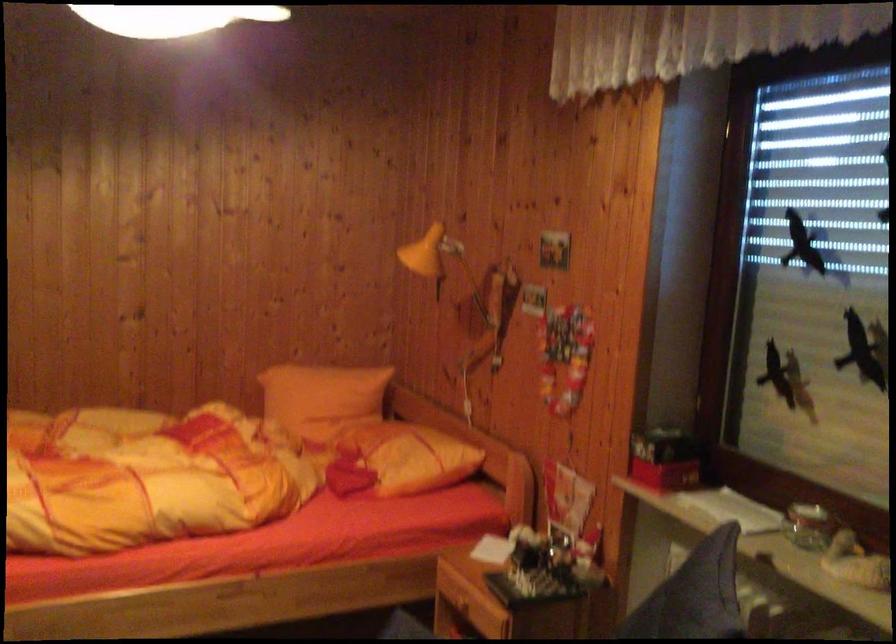
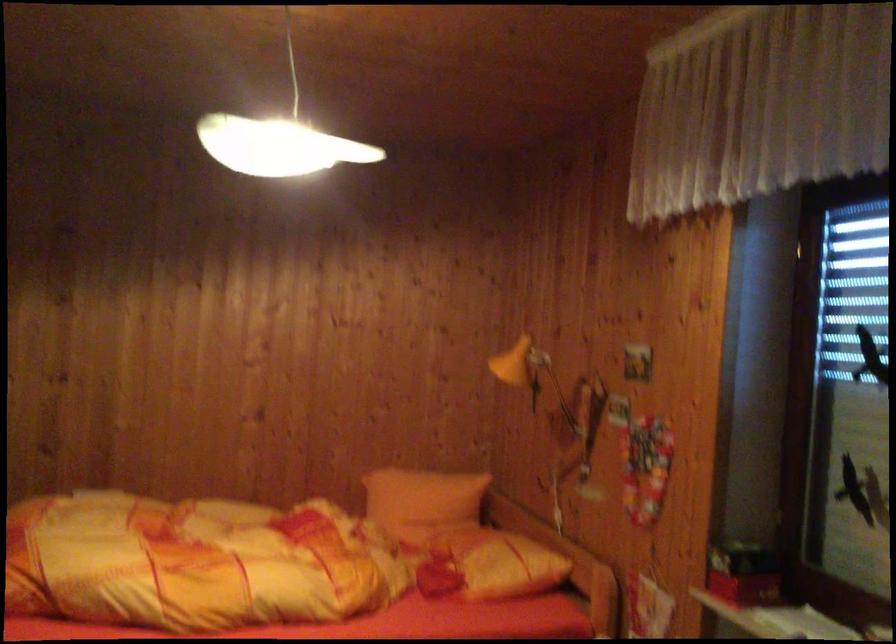
What movement of the cameraman would produce the second image?

The cameraman moved toward right, backward.